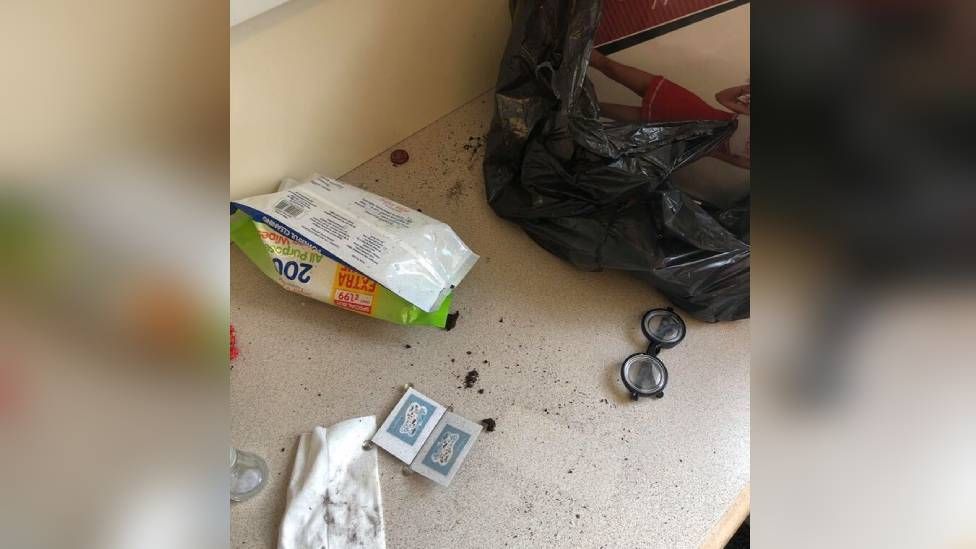
The height and width of the screenshot is (549, 976). Find the location of `wall`. wall is located at coordinates tap(244, 11).